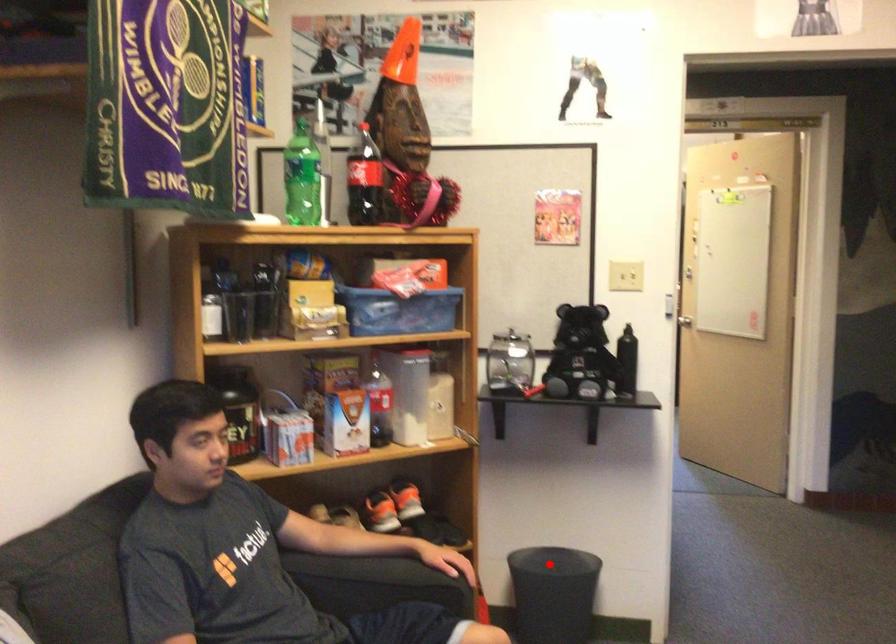
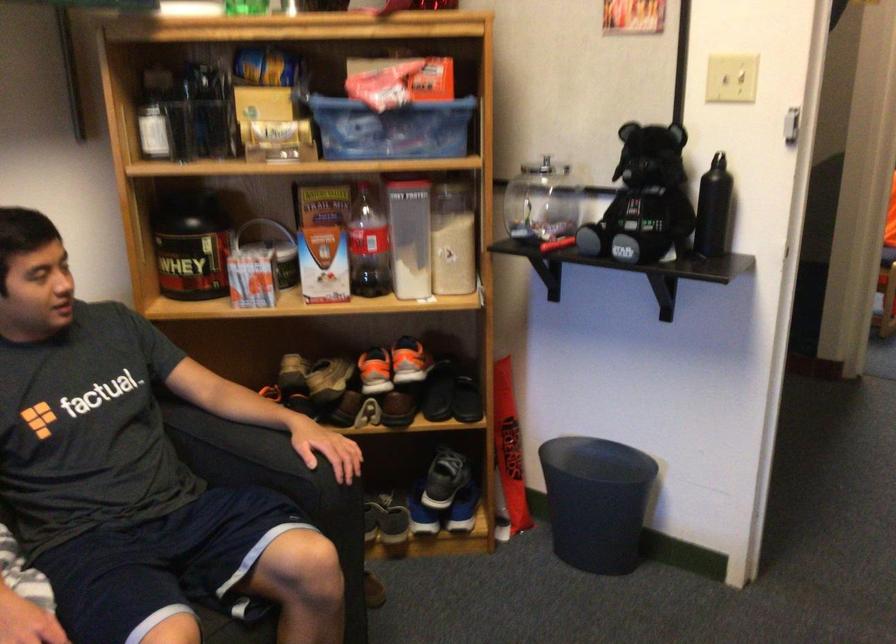
The point at the highlighted location is marked in the first image. Where is the corresponding point in the second image?

(597, 460)